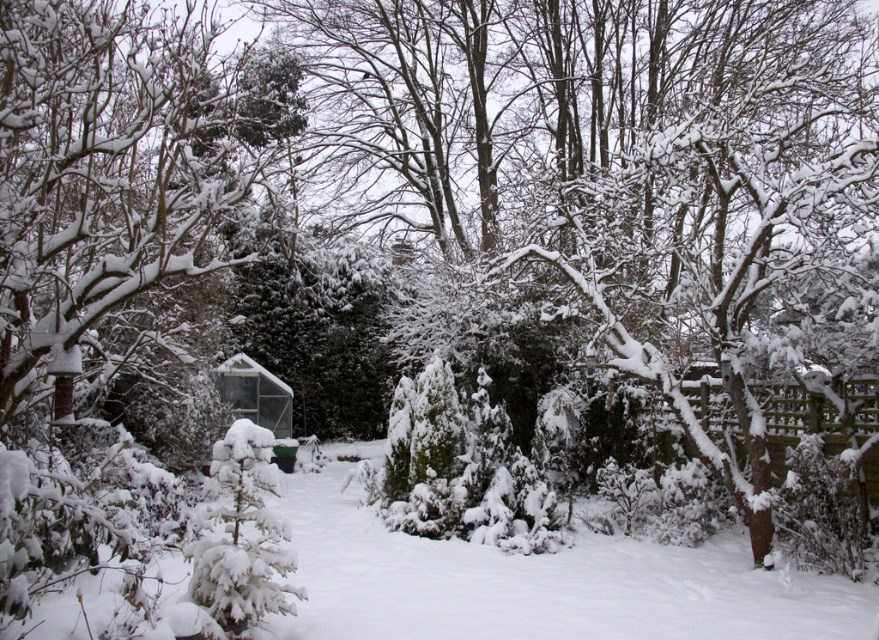
Question: Is snow-covered evergreen tree at left smaller than transparent plastic hut at center?

Choices:
 (A) no
 (B) yes

Answer: (A)

Question: Is snow-covered evergreen tree at left positioned before transparent plastic hut at center?

Choices:
 (A) yes
 (B) no

Answer: (A)

Question: Can you confirm if snow-covered evergreen tree at left is bigger than transparent plastic hut at center?

Choices:
 (A) yes
 (B) no

Answer: (A)